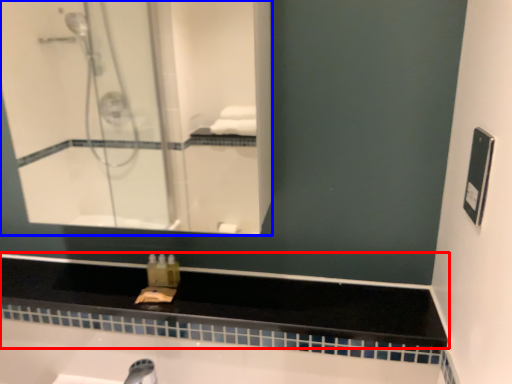
Question: Which object is further to the camera taking this photo, counter top (highlighted by a red box) or mirror (highlighted by a blue box)?

Choices:
 (A) counter top
 (B) mirror

Answer: (A)